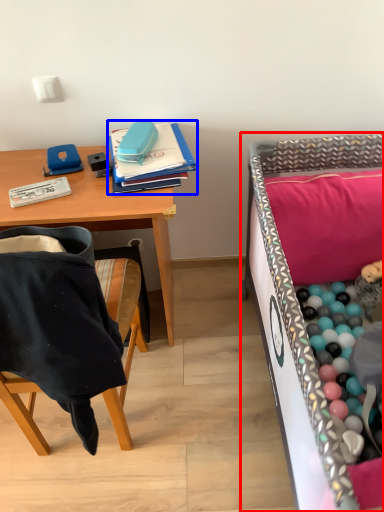
Question: Among these objects, which one is farthest to the camera, infant bed (highlighted by a red box) or notebook (highlighted by a blue box)?

Choices:
 (A) infant bed
 (B) notebook

Answer: (B)